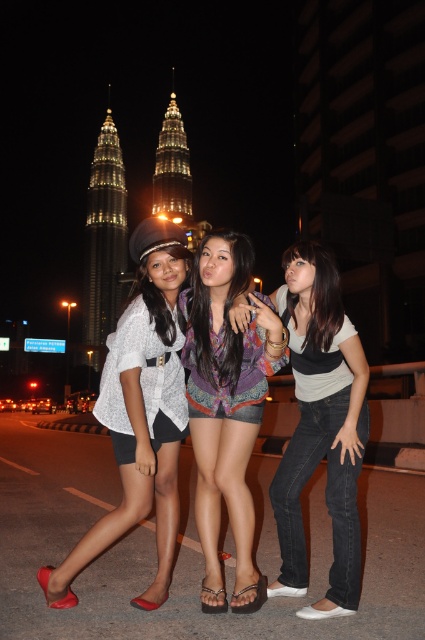
Question: Does matte white blouse at left appear over denim jeans at center?

Choices:
 (A) yes
 (B) no

Answer: (A)

Question: Is matte white blouse at left positioned before multicolored woven shirt at center?

Choices:
 (A) yes
 (B) no

Answer: (A)

Question: Which point appears farthest from the camera in this image?

Choices:
 (A) (190, 424)
 (B) (139, 230)

Answer: (B)

Question: Which of the following is the farthest from the observer?

Choices:
 (A) (231, 476)
 (B) (300, 406)
 (C) (181, 269)

Answer: (C)

Question: Estimate the real-world distances between objects in this image. Which object is closer to the multicolored woven shirt at center?

Choices:
 (A) matte white blouse at left
 (B) denim jeans at center

Answer: (A)

Question: Is matte white blouse at left positioned in front of multicolored woven shirt at center?

Choices:
 (A) yes
 (B) no

Answer: (A)